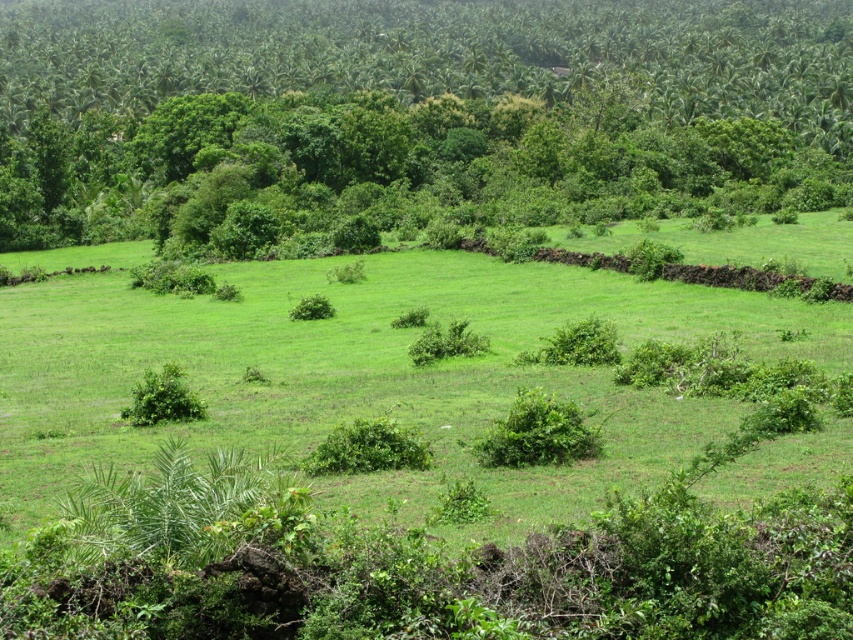
Question: Is green grass at center bigger than green leafy tree at upper center?

Choices:
 (A) no
 (B) yes

Answer: (A)

Question: Which of the following is the farthest from the observer?

Choices:
 (A) (389, 483)
 (B) (463, 49)

Answer: (B)

Question: Where is green grass at center located in relation to green leafy tree at upper center in the image?

Choices:
 (A) above
 (B) below

Answer: (B)

Question: Among these points, which one is farthest from the camera?

Choices:
 (A) (747, 257)
 (B) (323, 58)

Answer: (B)

Question: Does green grass at center have a smaller size compared to green leafy tree at upper center?

Choices:
 (A) no
 (B) yes

Answer: (B)